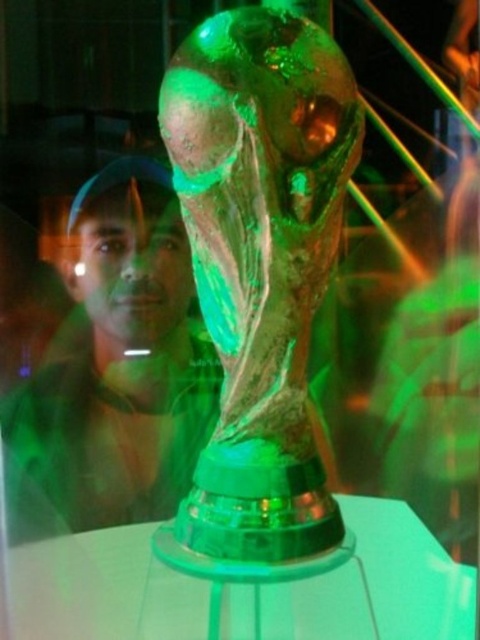
Is matte black cap at upper left positioned at the back of transparent glass table at center?

Yes.

Is matte black cap at upper left in front of transparent glass table at center?

No, matte black cap at upper left is behind transparent glass table at center.

What are the coordinates of `matte black cap at upper left` in the screenshot? It's located at (116, 371).

I want to click on matte black cap at upper left, so click(116, 371).